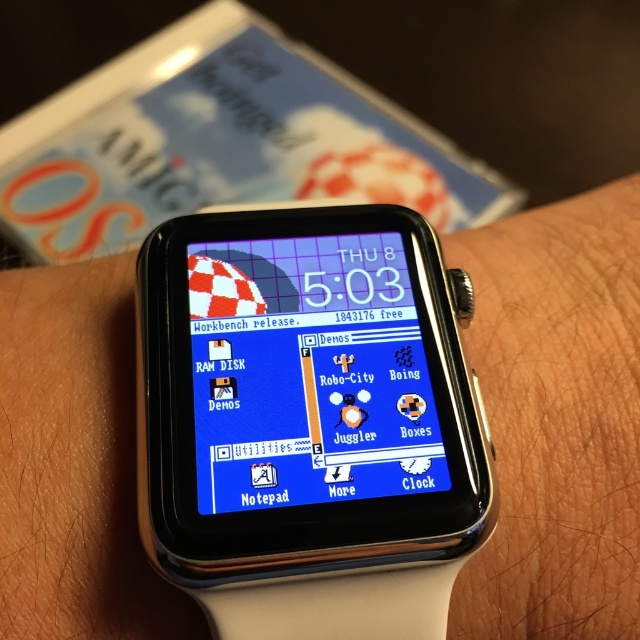
Question: Is satin black watch at center below blue glossy watch face at center?

Choices:
 (A) no
 (B) yes

Answer: (B)

Question: In this image, where is satin black watch at center located relative to blue glossy watch face at center?

Choices:
 (A) left
 (B) right

Answer: (B)

Question: Among these points, which one is farthest from the camera?

Choices:
 (A) (378, 538)
 (B) (340, 461)

Answer: (B)

Question: Does satin black watch at center have a lesser width compared to blue glossy watch face at center?

Choices:
 (A) yes
 (B) no

Answer: (B)